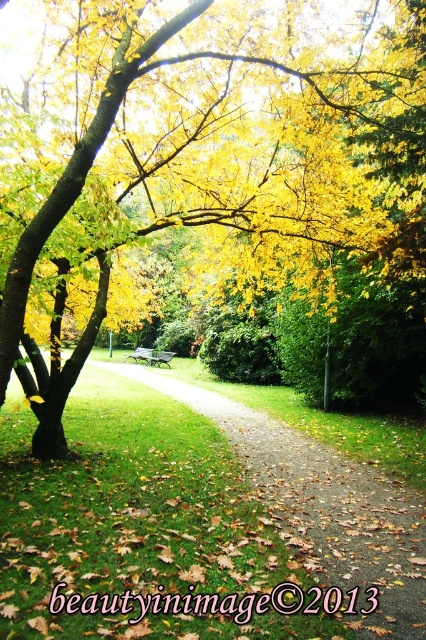
You are a painter setting up your easel to capture the autumn scene. You want to ensure your painting includes both the yellow leafy tree at upper left and the wooden park bench at center. Based on their sizes, which object should you focus on placing first in your composition?

The yellow leafy tree at upper left might be wider than the wooden park bench at center, so you should focus on placing the yellow leafy tree at upper left first to ensure it fits properly in the composition.

You are planning to place a new wooden park bench at center in the park. Considering the existing yellow leafy tree at upper left, which object would cast a bigger shadow during midday?

The yellow leafy tree at upper left is larger in size than the wooden park bench at center, so it would cast a bigger shadow during midday.

You are a park visitor wanting to sit on the wooden park bench at center. To avoid the falling leaves from the yellow leafy tree at upper left, where should you sit on the bench?

The yellow leafy tree at upper left is located above the wooden park bench at center, so sitting on the side of the bench facing away from the tree would help avoid falling leaves.